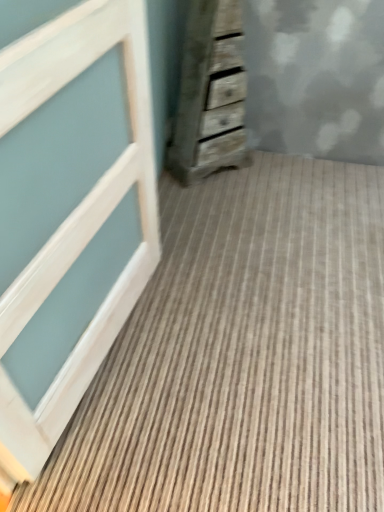
The height and width of the screenshot is (512, 384). Describe the element at coordinates (210, 93) in the screenshot. I see `distressed wood dresser at center` at that location.

Where is `distressed wood dresser at center`? The height and width of the screenshot is (512, 384). distressed wood dresser at center is located at coordinates (210, 93).

Find the location of a particular element. distressed wood dresser at center is located at coordinates (210, 93).